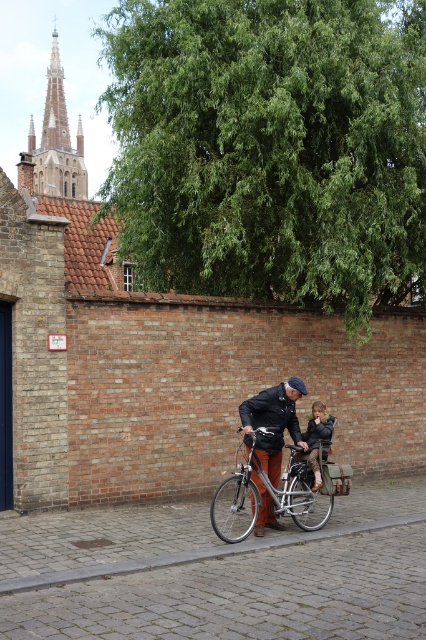
Which is below, silver metallic bicycle at center or dark brown leather jacket at center?

silver metallic bicycle at center is below.

Measure the distance between silver metallic bicycle at center and camera.

They are 23.96 feet apart.

Which is behind, point (313, 509) or point (319, 477)?

Point (313, 509)

This screenshot has width=426, height=640. I want to click on silver metallic bicycle at center, so coord(271,493).

Does silver metallic bicycle at center lie in front of brown leather jacket at center?

Yes, silver metallic bicycle at center is in front of brown leather jacket at center.

Is the position of silver metallic bicycle at center more distant than that of brown leather jacket at center?

That is False.

Is point (232, 541) positioned behind point (281, 451)?

No, (232, 541) is closer to viewer.

Image resolution: width=426 pixels, height=640 pixels. Identify the location of silver metallic bicycle at center. (271, 493).

Is brown leather jacket at center taller than dark brown leather jacket at center?

Correct, brown leather jacket at center is much taller as dark brown leather jacket at center.

At what (x,y) coordinates should I click in order to perform the action: click on brown leather jacket at center. Please return your answer as a coordinate pair (x, y). Looking at the image, I should click on (273, 422).